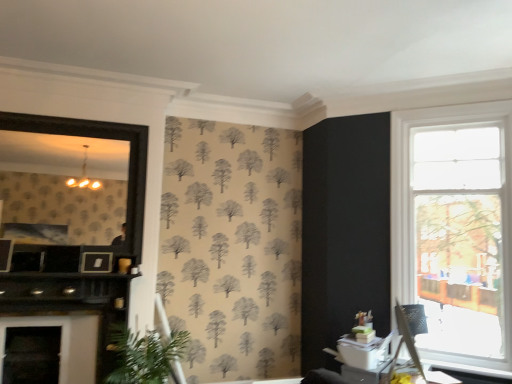
The height and width of the screenshot is (384, 512). What do you see at coordinates (364, 373) in the screenshot?
I see `white glossy table at lower right` at bounding box center [364, 373].

What is the approximate width of black matte fireplace at left?

black matte fireplace at left is 32.77 centimeters in width.

What do you see at coordinates (455, 228) in the screenshot?
I see `clear glass window at right` at bounding box center [455, 228].

What do you see at coordinates (96, 262) in the screenshot?
I see `matte black picture frame at upper left` at bounding box center [96, 262].

Where is `black wooden frame at left`? The height and width of the screenshot is (384, 512). black wooden frame at left is located at coordinates (99, 138).

You are a GUI agent. You are given a task and a screenshot of the screen. Output one action in this format:
    pyautogui.click(x=<x>, y=<y>)
    Task: Click on the green leafy plant at lower left
    This screenshot has height=384, width=512.
    Given the screenshot: What is the action you would take?
    143,355

This screenshot has height=384, width=512. Identify the location of white glossy table at lower right. (364, 373).

From a real-world perspective, is green leafy plant at lower left under black matte fireplace at left?

Yes.

Is green leafy plant at lower left not within black matte fireplace at left?

green leafy plant at lower left is positioned outside black matte fireplace at left.

Is point (123, 366) positioned in front of point (61, 306)?

Yes, it is.

Can you confirm if green leafy plant at lower left is thinner than black matte fireplace at left?

Incorrect, the width of green leafy plant at lower left is not less than that of black matte fireplace at left.

Is matte black picture frame at upper left far away from clear glass window at right?

Absolutely, matte black picture frame at upper left is distant from clear glass window at right.

From the image's perspective, is matte black picture frame at upper left above or below clear glass window at right?

matte black picture frame at upper left is below clear glass window at right.

From a real-world perspective, is matte black picture frame at upper left over clear glass window at right?

Incorrect, from a real-world perspective, matte black picture frame at upper left is lower than clear glass window at right.

Which is more to the left, matte black picture frame at upper left or clear glass window at right?

Positioned to the left is matte black picture frame at upper left.

Is green leafy plant at lower left positioned far away from black wooden frame at left?

Absolutely, green leafy plant at lower left is distant from black wooden frame at left.

From the picture: Considering the relative positions of green leafy plant at lower left and black wooden frame at left in the image provided, is green leafy plant at lower left to the left of black wooden frame at left from the viewer's perspective?

Incorrect, green leafy plant at lower left is not on the left side of black wooden frame at left.

Which object is closer to the camera, green leafy plant at lower left or black wooden frame at left?

green leafy plant at lower left is closer to the camera.

Based on the photo, which is less distant, (123, 361) or (9, 114)?

Point (123, 361) is closer to the camera than point (9, 114).

Which is more distant, [440,169] or [4,316]?

Point [440,169]

Are clear glass window at right and black matte fireplace at left making contact?

They are not placed beside each other.

Which of these two, clear glass window at right or black matte fireplace at left, stands shorter?

With less height is black matte fireplace at left.

Does black wooden frame at left have a greater width compared to clear glass window at right?

No.

Considering the relative sizes of black wooden frame at left and clear glass window at right in the image provided, is black wooden frame at left shorter than clear glass window at right?

Indeed, black wooden frame at left has a lesser height compared to clear glass window at right.

From the image's perspective, does black wooden frame at left appear lower than clear glass window at right?

No, from the image's perspective, black wooden frame at left is not beneath clear glass window at right.

Looking at this image, considering the positions of objects black wooden frame at left and clear glass window at right in the image provided, who is more to the left, black wooden frame at left or clear glass window at right?

Positioned to the left is black wooden frame at left.

Between clear glass window at right and matte black picture frame at upper left, which one has larger width?

clear glass window at right is wider.

Between point (498, 267) and point (105, 268), which one is positioned behind?

The point (105, 268) is more distant.

Considering the positions of objects clear glass window at right and matte black picture frame at upper left in the image provided, who is behind, clear glass window at right or matte black picture frame at upper left?

matte black picture frame at upper left is behind.

Is clear glass window at right oriented towards matte black picture frame at upper left?

No, clear glass window at right is not facing towards matte black picture frame at upper left.

Where is `window on the right of white glossy table at lower right`? window on the right of white glossy table at lower right is located at coordinates (455, 228).

From a real-world perspective, relative to white glossy table at lower right, is clear glass window at right vertically above or below?

Clearly, from a real-world perspective, clear glass window at right is above white glossy table at lower right.

Which object is closer to the camera, clear glass window at right or white glossy table at lower right?

Positioned in front is clear glass window at right.

In the scene shown: From the image's perspective, is clear glass window at right positioned above or below white glossy table at lower right?

clear glass window at right is situated higher than white glossy table at lower right in the image.

The width and height of the screenshot is (512, 384). Identify the location of dresser that appears above the green leafy plant at lower left (from a real-world perspective). (70, 303).

The width and height of the screenshot is (512, 384). What are the coordinates of `window above the matte black picture frame at upper left (from the image's perspective)` in the screenshot? It's located at (455, 228).

Considering their positions, is matte black picture frame at upper left positioned further to clear glass window at right than white glossy table at lower right?

The object further to clear glass window at right is matte black picture frame at upper left.

Which object lies nearer to the anchor point matte black picture frame at upper left, white glossy table at lower right or clear glass window at right?

Based on the image, white glossy table at lower right appears to be nearer to matte black picture frame at upper left.

In the scene shown: From the image, which object appears to be farther from white glossy table at lower right, black wooden frame at left or green leafy plant at lower left?

black wooden frame at left is further to white glossy table at lower right.

Which object lies nearer to the anchor point black matte fireplace at left, white glossy table at lower right or green leafy plant at lower left?

green leafy plant at lower left.

When comparing their distances from matte black picture frame at upper left, does green leafy plant at lower left or clear glass window at right seem further?

Based on the image, clear glass window at right appears to be further to matte black picture frame at upper left.

Based on their spatial positions, is black wooden frame at left or green leafy plant at lower left further from black matte fireplace at left?

Based on the image, black wooden frame at left appears to be further to black matte fireplace at left.

When comparing their distances from matte black picture frame at upper left, does white glossy table at lower right or green leafy plant at lower left seem further?

Among the two, white glossy table at lower right is located further to matte black picture frame at upper left.

Based on their spatial positions, is black wooden frame at left or clear glass window at right closer to black matte fireplace at left?

black wooden frame at left is closer to black matte fireplace at left.

You are a GUI agent. You are given a task and a screenshot of the screen. Output one action in this format:
    pyautogui.click(x=<x>, y=<y>)
    Task: Click on the houseplant between black wooden frame at left and white glossy table at lower right
    This screenshot has width=512, height=384.
    Given the screenshot: What is the action you would take?
    pyautogui.click(x=143, y=355)

You are a GUI agent. You are given a task and a screenshot of the screen. Output one action in this format:
    pyautogui.click(x=<x>, y=<y>)
    Task: Click on the dresser situated between black wooden frame at left and white glossy table at lower right from left to right
    The height and width of the screenshot is (384, 512).
    Given the screenshot: What is the action you would take?
    pyautogui.click(x=70, y=303)

The image size is (512, 384). Find the location of `table between matte black picture frame at upper left and clear glass window at right in the horizontal direction`. table between matte black picture frame at upper left and clear glass window at right in the horizontal direction is located at coordinates (364, 373).

Find the location of a particular element. This screenshot has width=512, height=384. picture frame between black matte fireplace at left and clear glass window at right is located at coordinates (96, 262).